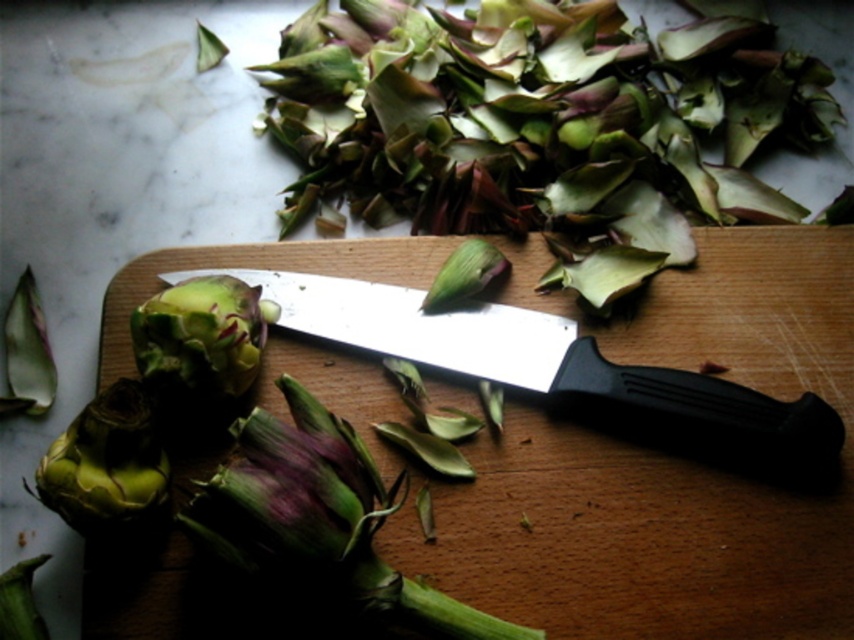
Question: Is purple matte artichoke at center smaller than green matte artichoke at center?

Choices:
 (A) no
 (B) yes

Answer: (A)

Question: Can you confirm if black plastic knife at center is thinner than green matte artichoke at lower left?

Choices:
 (A) no
 (B) yes

Answer: (A)

Question: Considering the real-world distances, which object is closest to the black plastic knife at center?

Choices:
 (A) green matte artichoke at center
 (B) purple matte artichoke at center
 (C) green matte artichoke at lower left

Answer: (A)

Question: Estimate the real-world distances between objects in this image. Which object is closer to the green matte artichoke at lower left?

Choices:
 (A) green matte artichoke at center
 (B) black plastic knife at center

Answer: (A)

Question: Which object is farther from the camera taking this photo?

Choices:
 (A) green matte artichoke at center
 (B) green matte artichoke at lower left

Answer: (A)

Question: Can you confirm if green matte artichoke at lower left is thinner than green matte artichoke at center?

Choices:
 (A) yes
 (B) no

Answer: (B)